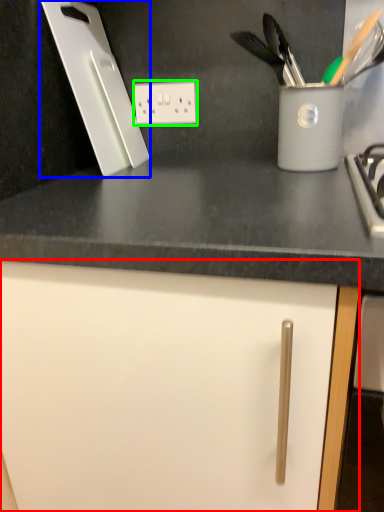
Question: Estimate the real-world distances between objects in this image. Which object is farther from cabinetry (highlighted by a red box), kitchen appliance (highlighted by a blue box) or electric outlet (highlighted by a green box)?

Choices:
 (A) kitchen appliance
 (B) electric outlet

Answer: (B)